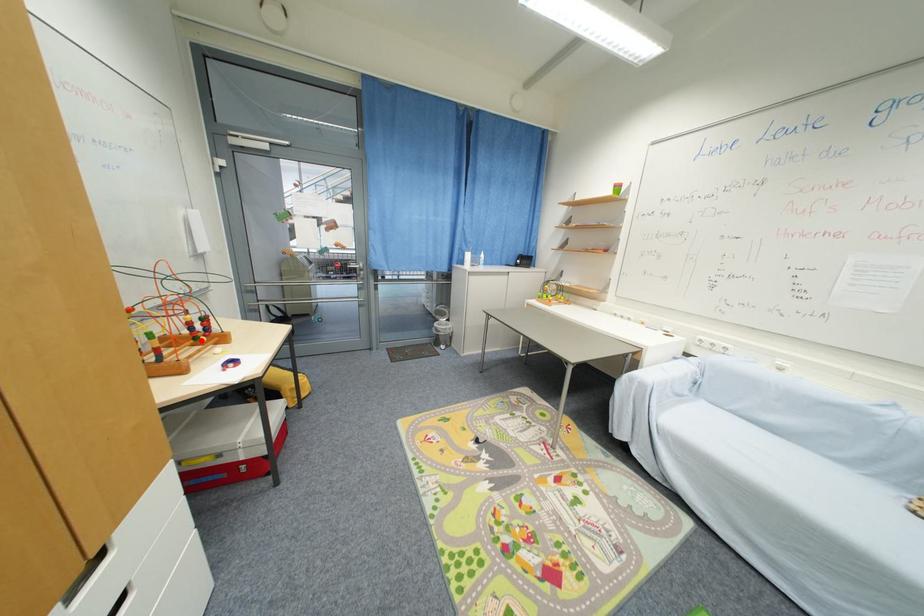
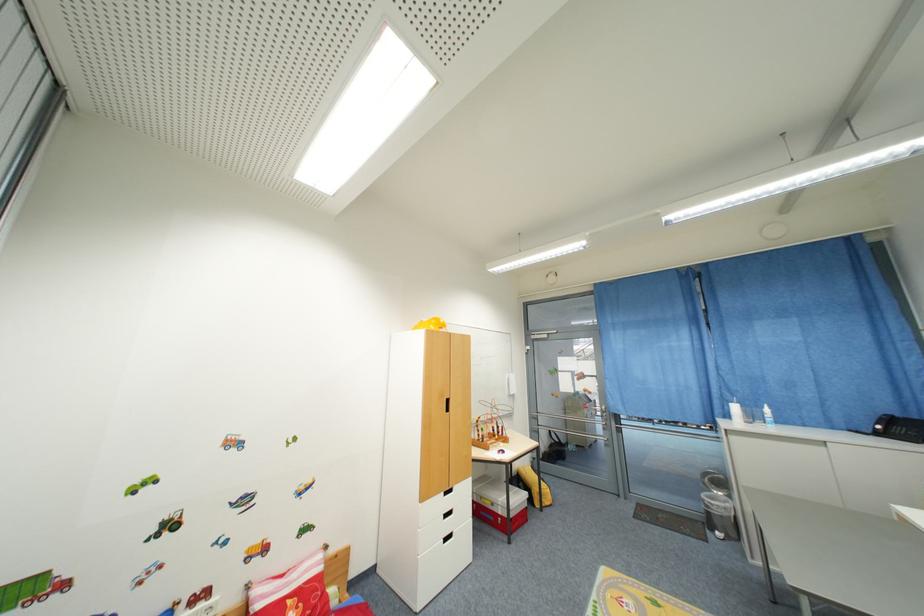
Question: I am providing you with two images of the same scene from different viewpoints. In image1, a red point is highlighted. Considering the same 3D point in image2, which of the following is correct?

Choices:
 (A) It is closer
 (B) It is farther

Answer: (B)